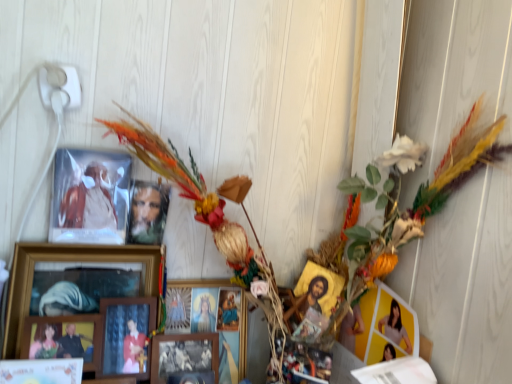
Measure the distance between point [128,298] and camera.

The distance of point [128,298] from camera is 38.03 inches.

The image size is (512, 384). Describe the element at coordinates (317, 300) in the screenshot. I see `gold textured icon at center-right, which is the 8th picture frame in left-to-right order` at that location.

Describe the element at coordinates (147, 212) in the screenshot. I see `matte wooden portrait at upper left, arranged as the fifth picture frame when viewed from the left` at that location.

The image size is (512, 384). Identify the location of wooden framed picture at center, the second picture frame positioned from the right. (209, 320).

Locate an element on the screen. Image resolution: width=512 pixels, height=384 pixels. wooden photo frame at center, acting as the 3th picture frame starting from the right is located at coordinates (184, 355).

Considering the relative positions of multicolored feathered wreath at upper left and gold textured icon at center-right, which is the 8th picture frame in left-to-right order, in the image provided, is multicolored feathered wreath at upper left behind gold textured icon at center-right, which is the 8th picture frame in left-to-right order,?

That is False.

Locate an element on the screen. The height and width of the screenshot is (384, 512). picture frame on the right of multicolored feathered wreath at upper left is located at coordinates coord(317,300).

Which is farther from the camera, (426, 190) or (302, 285)?

The point (302, 285) is farther from the camera.

From the image's perspective, between multicolored feathered wreath at upper left and gold textured icon at center-right, which is the first picture frame from right to left, which one is located above?

multicolored feathered wreath at upper left.

Who is shorter, wooden framed picture at center, the 4th picture frame in the left-to-right sequence, or white glossy picture frame at lower left, the first picture frame from the left?

With less height is white glossy picture frame at lower left, the first picture frame from the left.

From a real-world perspective, who is located lower, wooden framed picture at center, the 4th picture frame in the left-to-right sequence, or white glossy picture frame at lower left, the first picture frame from the left?

white glossy picture frame at lower left, the first picture frame from the left.

Which is in front, point (154, 305) or point (25, 381)?

Positioned in front is point (25, 381).

Looking at this image, considering the sizes of objects wooden framed picture at center, the 4th picture frame in the left-to-right sequence, and white glossy picture frame at lower left, the eighth picture frame in the right-to-left sequence, in the image provided, who is thinner, wooden framed picture at center, the 4th picture frame in the left-to-right sequence, or white glossy picture frame at lower left, the eighth picture frame in the right-to-left sequence,?

Thinner between the two is wooden framed picture at center, the 4th picture frame in the left-to-right sequence.

Which is less distant, (129, 212) or (152, 315)?

Point (152, 315)

Is matte wooden portrait at upper left, arranged as the fifth picture frame when viewed from the left, facing towards wooden framed picture at center, the fifth picture frame viewed from the right?

No.

Which picture frame is the 4th one when counting from the back of the wooden framed picture at center, the 4th picture frame in the left-to-right sequence? Please provide its 2D coordinates.

[(147, 212)]

From a real-world perspective, is matte wooden portrait at upper left, marked as the 4th picture frame in a right-to-left arrangement, positioned under wooden framed picture at center, the fifth picture frame viewed from the right, based on gravity?

Actually, matte wooden portrait at upper left, marked as the 4th picture frame in a right-to-left arrangement, is physically above wooden framed picture at center, the fifth picture frame viewed from the right, in the real world.

Is wooden photo frame at center, acting as the 3th picture frame starting from the right, next to multicolored feathered wreath at upper left and touching it?

wooden photo frame at center, acting as the 3th picture frame starting from the right, and multicolored feathered wreath at upper left are clearly separated.

From a real-world perspective, is wooden photo frame at center, marked as the sixth picture frame in a left-to-right arrangement, above or below multicolored feathered wreath at upper left?

In terms of real-world spatial position, wooden photo frame at center, marked as the sixth picture frame in a left-to-right arrangement, is below multicolored feathered wreath at upper left.

How many degrees apart are the facing directions of wooden photo frame at center, acting as the 3th picture frame starting from the right, and multicolored feathered wreath at upper left?

wooden photo frame at center, acting as the 3th picture frame starting from the right, and multicolored feathered wreath at upper left are facing 0.381 degrees away from each other.

Considering the relative sizes of wooden photo frame at center, acting as the 3th picture frame starting from the right, and multicolored feathered wreath at upper left in the image provided, is wooden photo frame at center, acting as the 3th picture frame starting from the right, smaller than multicolored feathered wreath at upper left?

Yes, wooden photo frame at center, acting as the 3th picture frame starting from the right, is smaller than multicolored feathered wreath at upper left.

Which of these two, gold textured icon at center-right, which is the 8th picture frame in left-to-right order, or wooden photo frame at center, acting as the 3th picture frame starting from the right, is bigger?

With larger size is wooden photo frame at center, acting as the 3th picture frame starting from the right.

Between point (332, 272) and point (170, 381), which one is positioned in front?

The point (170, 381) is more forward.

Considering the relative positions of gold textured icon at center-right, which is the 8th picture frame in left-to-right order, and wooden photo frame at center, marked as the sixth picture frame in a left-to-right arrangement, in the image provided, is gold textured icon at center-right, which is the 8th picture frame in left-to-right order, to the left or to the right of wooden photo frame at center, marked as the sixth picture frame in a left-to-right arrangement,?

Based on their positions, gold textured icon at center-right, which is the 8th picture frame in left-to-right order, is located to the right of wooden photo frame at center, marked as the sixth picture frame in a left-to-right arrangement.

From a real-world perspective, is gold textured icon at center-right, which is the 8th picture frame in left-to-right order, on wooden photo frame at center, marked as the sixth picture frame in a left-to-right arrangement?

Indeed, from a real-world perspective, gold textured icon at center-right, which is the 8th picture frame in left-to-right order, stands above wooden photo frame at center, marked as the sixth picture frame in a left-to-right arrangement.

Does gold textured icon at center-right, which is the first picture frame from right to left, turn towards multicolored feathered wreath at upper left?

Yes, gold textured icon at center-right, which is the first picture frame from right to left, is oriented towards multicolored feathered wreath at upper left.

Who is smaller, gold textured icon at center-right, which is the first picture frame from right to left, or multicolored feathered wreath at upper left?

Smaller between the two is gold textured icon at center-right, which is the first picture frame from right to left.

Considering the points (309, 319) and (331, 331), which point is behind, point (309, 319) or point (331, 331)?

The point (331, 331) is behind.

Is gold textured icon at center-right, which is the 8th picture frame in left-to-right order, not close to multicolored feathered wreath at upper left?

gold textured icon at center-right, which is the 8th picture frame in left-to-right order, is near multicolored feathered wreath at upper left, not far away.

From the image's perspective, relative to wooden picture frame at lower left, which appears as the second picture frame when viewed from the left, is white glossy picture frame at lower left, the eighth picture frame in the right-to-left sequence, above or below?

From the image's perspective, white glossy picture frame at lower left, the eighth picture frame in the right-to-left sequence, appears below wooden picture frame at lower left, which appears as the second picture frame when viewed from the left.

Which object is wider, white glossy picture frame at lower left, the first picture frame from the left, or wooden picture frame at lower left, the 7th picture frame when ordered from right to left?

white glossy picture frame at lower left, the first picture frame from the left, is wider.

Looking at this image, who is smaller, white glossy picture frame at lower left, the first picture frame from the left, or wooden picture frame at lower left, the 7th picture frame when ordered from right to left?

wooden picture frame at lower left, the 7th picture frame when ordered from right to left.

How many degrees apart are the facing directions of white glossy picture frame at lower left, the first picture frame from the left, and wooden picture frame at lower left, the 7th picture frame when ordered from right to left?

0.237 degrees separate the facing orientations of white glossy picture frame at lower left, the first picture frame from the left, and wooden picture frame at lower left, the 7th picture frame when ordered from right to left.

Where is `floral arrangement in front of the gold textured icon at center-right, which is the 8th picture frame in left-to-right order`? floral arrangement in front of the gold textured icon at center-right, which is the 8th picture frame in left-to-right order is located at coordinates (413, 202).

The height and width of the screenshot is (384, 512). Find the location of `the 3rd picture frame below the wooden framed picture at center, the fifth picture frame viewed from the right (from the image's perspective)`. the 3rd picture frame below the wooden framed picture at center, the fifth picture frame viewed from the right (from the image's perspective) is located at coordinates (41, 371).

When comparing their distances from wooden framed picture at center, the fifth picture frame viewed from the right, does wooden photo frame at center, marked as the sixth picture frame in a left-to-right arrangement, or multicolored feathered wreath at upper left seem further?

multicolored feathered wreath at upper left.

Which object lies nearer to the anchor point wooden picture frame at center-left, acting as the 6th picture frame starting from the right, wooden framed picture at center, the fifth picture frame viewed from the right, or gold textured icon at center-right, which is the 8th picture frame in left-to-right order?

wooden framed picture at center, the fifth picture frame viewed from the right.

From the image, which object appears to be farther from wooden photo frame at center, acting as the 3th picture frame starting from the right, wooden picture frame at lower left, the 7th picture frame when ordered from right to left, or wooden picture frame at center-left, the third picture frame viewed from the left?

Among the two, wooden picture frame at center-left, the third picture frame viewed from the left, is located further to wooden photo frame at center, acting as the 3th picture frame starting from the right.

Which object lies nearer to the anchor point multicolored feathered wreath at upper left, gold textured icon at center-right, which is the first picture frame from right to left, or wooden photo frame at center, marked as the sixth picture frame in a left-to-right arrangement?

gold textured icon at center-right, which is the first picture frame from right to left, lies closer to multicolored feathered wreath at upper left than the other object.

Based on their spatial positions, is wooden photo frame at center, acting as the 3th picture frame starting from the right, or wooden picture frame at center-left, acting as the 6th picture frame starting from the right, closer to multicolored feathered wreath at upper left?

Based on the image, wooden photo frame at center, acting as the 3th picture frame starting from the right, appears to be nearer to multicolored feathered wreath at upper left.

Estimate the real-world distances between objects in this image. Which object is closer to wooden framed picture at center, the 4th picture frame in the left-to-right sequence, wooden photo frame at center, acting as the 3th picture frame starting from the right, or wooden framed picture at center, the 7th picture frame when ordered from left to right?

Based on the image, wooden photo frame at center, acting as the 3th picture frame starting from the right, appears to be nearer to wooden framed picture at center, the 4th picture frame in the left-to-right sequence.

When comparing their distances from white glossy picture frame at lower left, the first picture frame from the left, does wooden picture frame at lower left, which appears as the second picture frame when viewed from the left, or wooden framed picture at center, the 4th picture frame in the left-to-right sequence, seem closer?

wooden picture frame at lower left, which appears as the second picture frame when viewed from the left, lies closer to white glossy picture frame at lower left, the first picture frame from the left, than the other object.

Considering their positions, is wooden picture frame at center-left, acting as the 6th picture frame starting from the right, positioned further to multicolored feathered wreath at upper left than wooden photo frame at center, marked as the sixth picture frame in a left-to-right arrangement?

wooden picture frame at center-left, acting as the 6th picture frame starting from the right.

Locate an element on the screen. The height and width of the screenshot is (384, 512). picture frame situated between wooden photo frame at center, marked as the sixth picture frame in a left-to-right arrangement, and gold textured icon at center-right, which is the 8th picture frame in left-to-right order, from left to right is located at coordinates (209, 320).

Where is `floral arrangement between white glossy picture frame at lower left, the first picture frame from the left, and gold textured icon at center-right, which is the first picture frame from right to left, in the horizontal direction`? floral arrangement between white glossy picture frame at lower left, the first picture frame from the left, and gold textured icon at center-right, which is the first picture frame from right to left, in the horizontal direction is located at coordinates (413, 202).

You are a GUI agent. You are given a task and a screenshot of the screen. Output one action in this format:
    pyautogui.click(x=<x>, y=<y>)
    Task: Click on the floral arrangement between wooden picture frame at lower left, which appears as the second picture frame when viewed from the left, and gold textured icon at center-right, which is the 8th picture frame in left-to-right order, in the horizontal direction
    Image resolution: width=512 pixels, height=384 pixels.
    Given the screenshot: What is the action you would take?
    pyautogui.click(x=413, y=202)

This screenshot has height=384, width=512. Identify the location of picture frame between wooden picture frame at lower left, the 7th picture frame when ordered from right to left, and wooden framed picture at center, the 4th picture frame in the left-to-right sequence, in the horizontal direction. (74, 281).